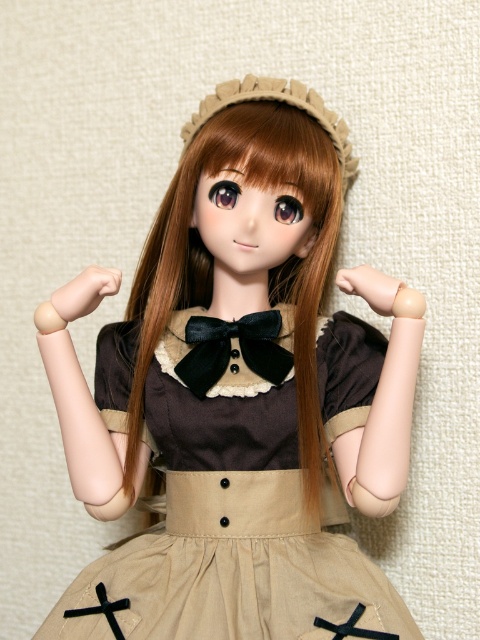
Question: Is brown silky hair at center below black satin bow tie at center?

Choices:
 (A) no
 (B) yes

Answer: (A)

Question: Which of these objects is positioned closest to the black satin bow tie at center?

Choices:
 (A) matte brown dress at center
 (B) brown silky hair at center

Answer: (B)

Question: Which point is farther from the camera taking this photo?

Choices:
 (A) (310, 365)
 (B) (326, 156)
 (C) (282, 358)

Answer: (B)

Question: Is matte brown dress at center thinner than brown silky hair at center?

Choices:
 (A) no
 (B) yes

Answer: (A)

Question: Among these objects, which one is nearest to the camera?

Choices:
 (A) black satin bow tie at center
 (B) brown silky hair at center

Answer: (B)

Question: From the image, what is the correct spatial relationship of brown silky hair at center in relation to black satin bow tie at center?

Choices:
 (A) below
 (B) above

Answer: (B)